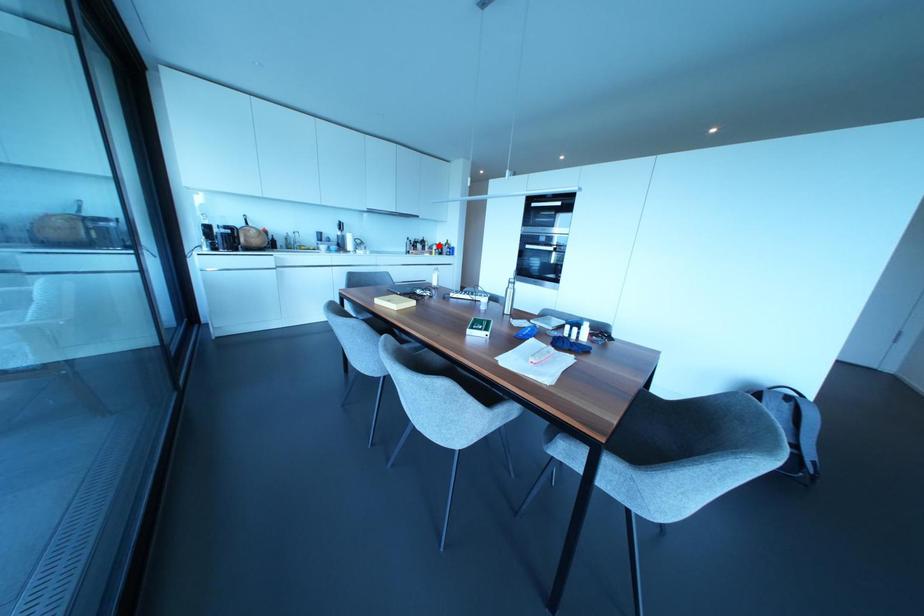
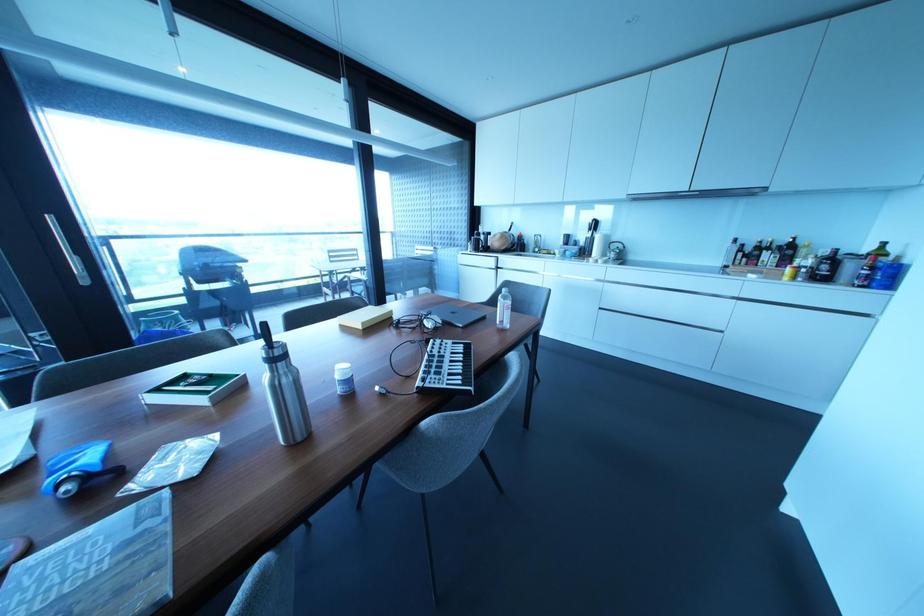
Question: I am providing you with two images of the same scene from different viewpoints. In image1, a red point is highlighted. Considering the same 3D point in image2, which of the following is correct?

Choices:
 (A) It is closer
 (B) It is farther

Answer: (B)